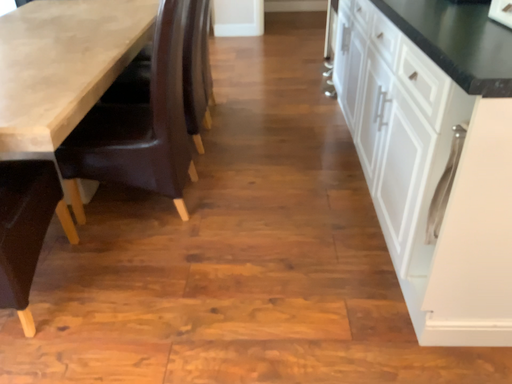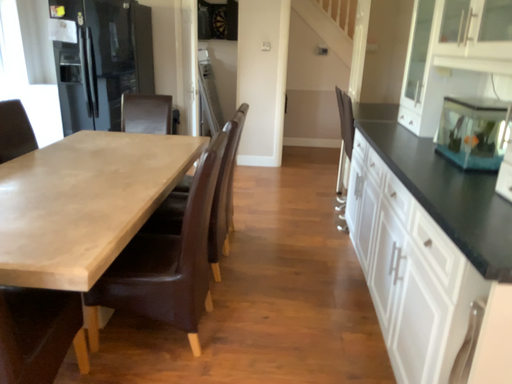
Question: Which way did the camera rotate in the video?

Choices:
 (A) rotated downward
 (B) rotated upward

Answer: (B)